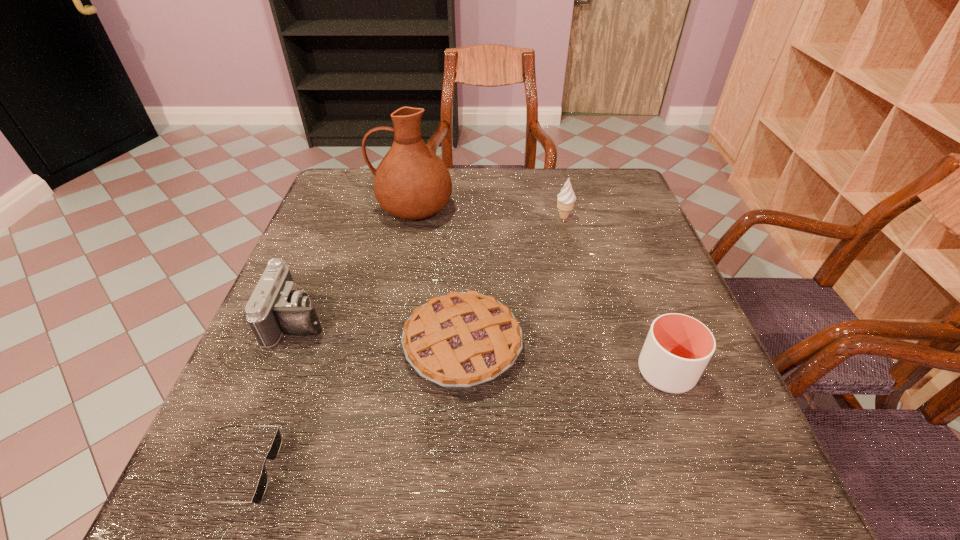
This screenshot has width=960, height=540. I want to click on sunglasses present at the left edge, so click(x=276, y=444).

The height and width of the screenshot is (540, 960). I want to click on object present at the right edge, so click(678, 347).

The height and width of the screenshot is (540, 960). I want to click on object positioned at the far left corner, so click(411, 182).

Identify the location of object that is at the near left corner. The height and width of the screenshot is (540, 960). (276, 444).

Locate an element on the screen. This screenshot has width=960, height=540. free region at the far edge of the desktop is located at coordinates pyautogui.click(x=535, y=208).

In the image, there is a desktop. Where is `vacant space at the near edge`? The width and height of the screenshot is (960, 540). vacant space at the near edge is located at coordinates (588, 481).

This screenshot has width=960, height=540. In the image, there is a desktop. Identify the location of vacant area at the left edge. (305, 259).

The image size is (960, 540). Identify the location of free region at the right edge of the desktop. (623, 244).

Where is `vacant area at the far left corner of the desktop`? Image resolution: width=960 pixels, height=540 pixels. vacant area at the far left corner of the desktop is located at coordinates (348, 185).

What are the coordinates of `vacant region at the far right corner of the desktop` in the screenshot? It's located at (620, 205).